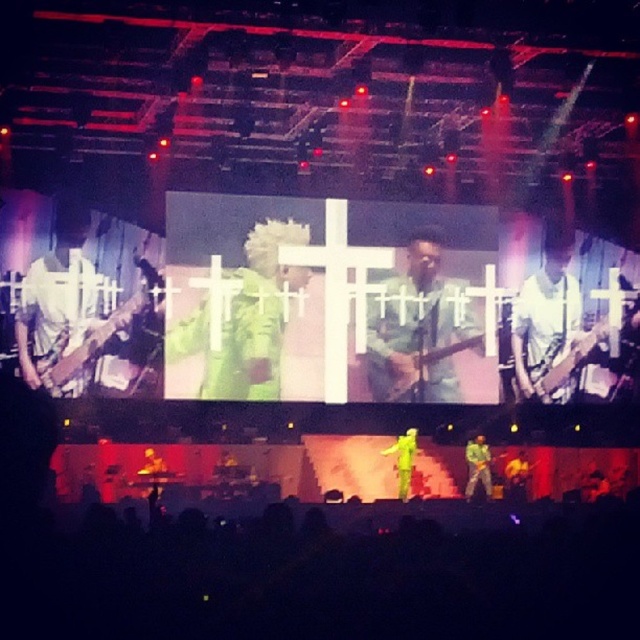
You are a photographer at the concert venue and want to capture a photo of both the green fabric guitar at center and the bright yellow suit at center. From the audience perspective, which object should you focus on first to ensure both are in frame?

The green fabric guitar at center is positioned on the right side of bright yellow suit at center, so you should focus on the bright yellow suit at center first to ensure both are in frame.

You are a photographer at the concert venue and want to capture a photo of both performers. The stage has two points marked as point 1 at coordinates point (404, 492) and point 2 at coordinates point (512, 465). If you position your camera at point 1, will the performer at point 2 be visible in the photo?

Yes, because point (404, 492) is in front of point (512, 465), so the performer at point 2 will be visible behind the performer at point 1 in the photo.